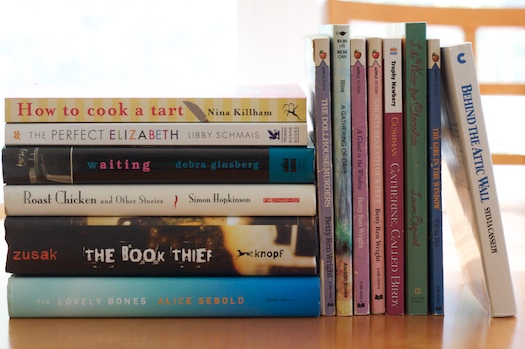
At what (x,y) coordinates should I click in order to perform the action: click on book laying flat. Please return your answer as a coordinate pair (x, y). The image size is (525, 349). Looking at the image, I should click on (152, 109), (171, 132), (180, 161), (184, 197), (190, 239), (188, 301).